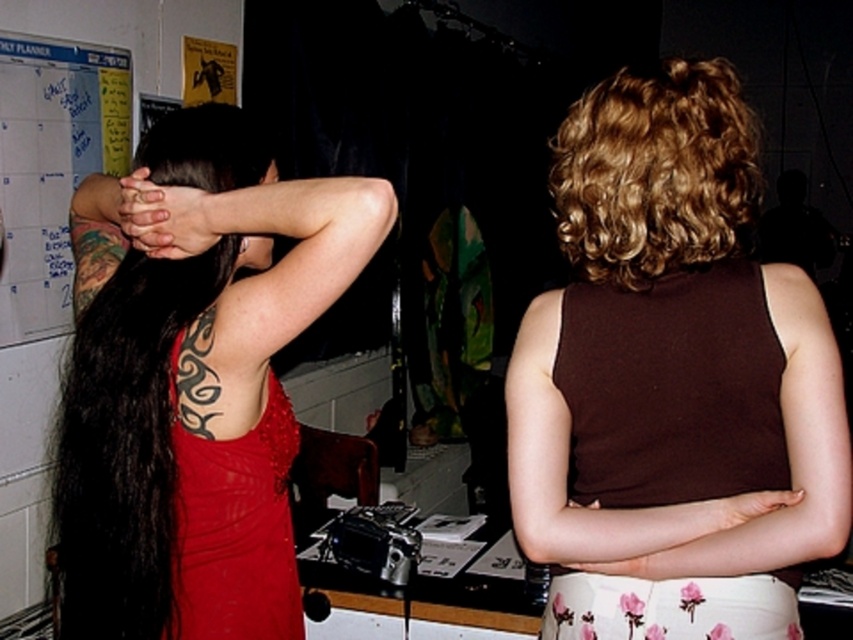
Can you confirm if brown matte tank top at center is positioned below curly blonde hair at upper right?

Correct, brown matte tank top at center is located below curly blonde hair at upper right.

Can you confirm if brown matte tank top at center is bigger than curly blonde hair at upper right?

Correct, brown matte tank top at center is larger in size than curly blonde hair at upper right.

The height and width of the screenshot is (640, 853). What do you see at coordinates (671, 378) in the screenshot? I see `brown matte tank top at center` at bounding box center [671, 378].

Locate an element on the screen. The width and height of the screenshot is (853, 640). brown matte tank top at center is located at coordinates (671, 378).

Which is more to the left, matte black hair at upper left or matte black hands at upper left?

Positioned to the left is matte black hair at upper left.

Between point (157, 128) and point (167, 209), which one is positioned in front?

Point (167, 209) is more forward.

This screenshot has height=640, width=853. Describe the element at coordinates (207, 148) in the screenshot. I see `matte black hair at upper left` at that location.

This screenshot has width=853, height=640. In order to click on matte black hair at upper left in this screenshot , I will do `click(207, 148)`.

Does brown matte tank top at center have a larger size compared to matte black hair at upper left?

Indeed, brown matte tank top at center has a larger size compared to matte black hair at upper left.

Can you confirm if brown matte tank top at center is positioned to the right of matte black hair at upper left?

Yes, brown matte tank top at center is to the right of matte black hair at upper left.

Is point (791, 387) farther from viewer compared to point (210, 148)?

No, it is in front of (210, 148).

Locate an element on the screen. brown matte tank top at center is located at coordinates (671, 378).